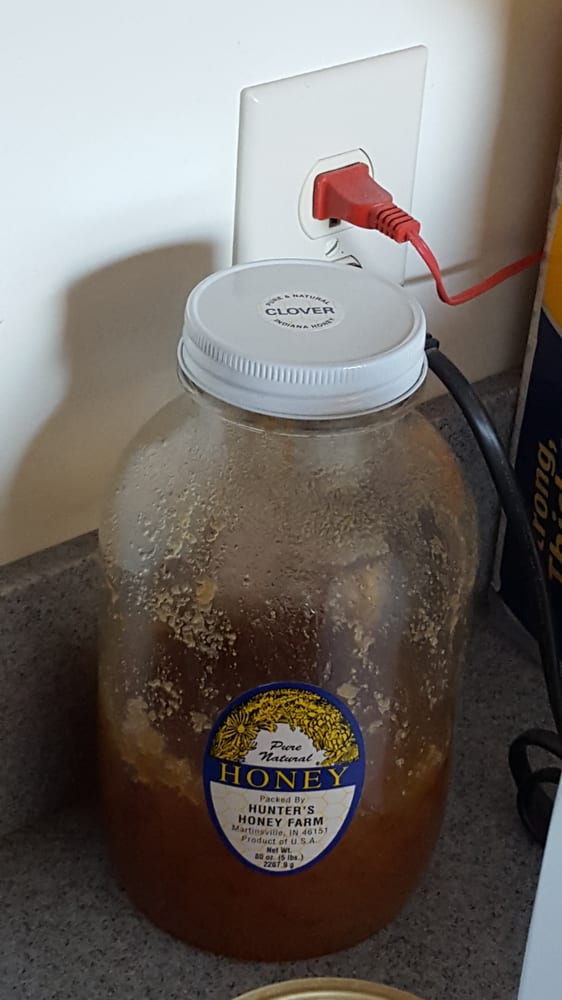
I want to click on glass jar, so click(163, 667).